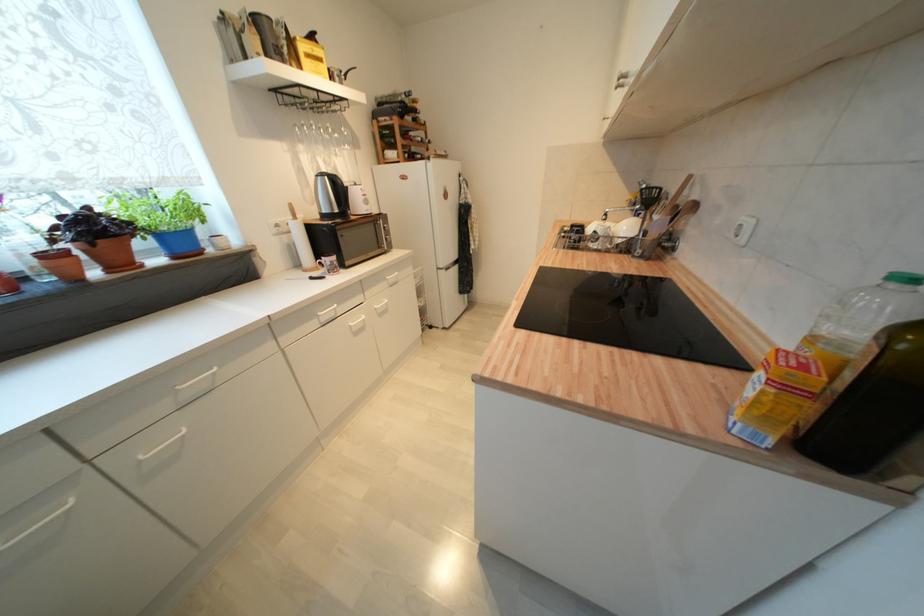
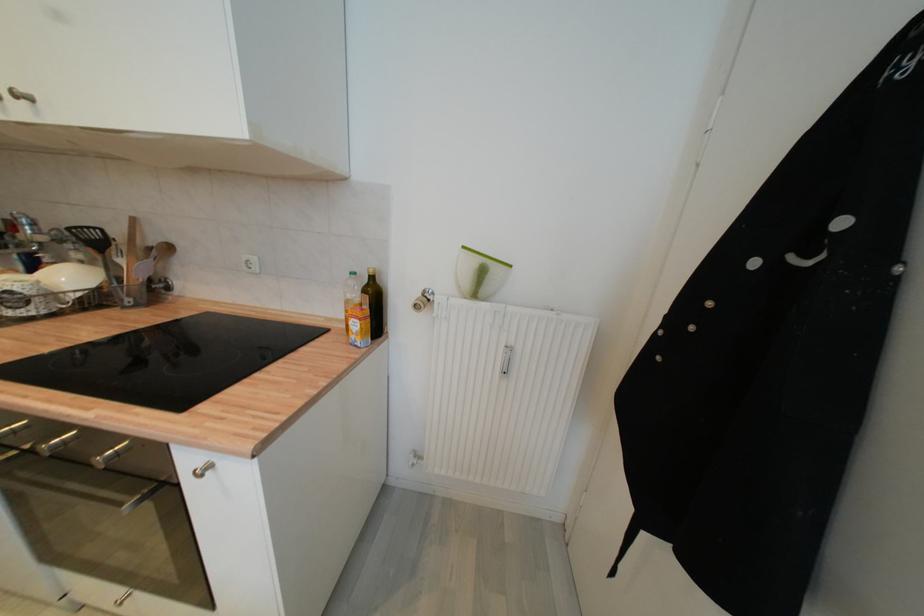
How did the camera likely rotate?

The rotation direction of the camera is right-down.